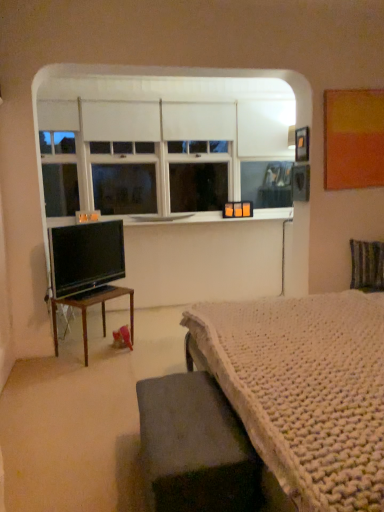
Question: Is striped fabric swivel chair at right bigger than wooden table at left, placed as the 1th table when sorted from back to front?

Choices:
 (A) no
 (B) yes

Answer: (A)

Question: Are striped fabric swivel chair at right and wooden table at left, placed as the 1th table when sorted from back to front, making contact?

Choices:
 (A) yes
 (B) no

Answer: (B)

Question: From a real-world perspective, is striped fabric swivel chair at right positioned over wooden table at left, which appears as the second table when viewed from the right, based on gravity?

Choices:
 (A) no
 (B) yes

Answer: (B)

Question: Is striped fabric swivel chair at right not near wooden table at left, placed as the 1th table when sorted from back to front?

Choices:
 (A) yes
 (B) no

Answer: (A)

Question: Does striped fabric swivel chair at right have a lesser height compared to wooden table at left, which is counted as the first table, starting from the left?

Choices:
 (A) no
 (B) yes

Answer: (B)

Question: From a real-world perspective, relative to white smooth window sill at center, is dark gray fabric ottoman at lower center, positioned as the second table in back-to-front order, vertically above or below?

Choices:
 (A) above
 (B) below

Answer: (B)

Question: Based on their positions, is dark gray fabric ottoman at lower center, the second table viewed from the left, located to the left or right of white smooth window sill at center?

Choices:
 (A) left
 (B) right

Answer: (B)

Question: Considering the positions of dark gray fabric ottoman at lower center, the second table viewed from the left, and white smooth window sill at center in the image, is dark gray fabric ottoman at lower center, the second table viewed from the left, bigger or smaller than white smooth window sill at center?

Choices:
 (A) small
 (B) big

Answer: (B)

Question: Is dark gray fabric ottoman at lower center, the 1th table positioned from the right, spatially inside white smooth window sill at center, or outside of it?

Choices:
 (A) outside
 (B) inside

Answer: (A)

Question: From a real-world perspective, is white knitted blanket at lower right above or below striped fabric swivel chair at right?

Choices:
 (A) above
 (B) below

Answer: (B)

Question: In terms of size, does white knitted blanket at lower right appear bigger or smaller than striped fabric swivel chair at right?

Choices:
 (A) small
 (B) big

Answer: (B)

Question: In terms of width, does white knitted blanket at lower right look wider or thinner when compared to striped fabric swivel chair at right?

Choices:
 (A) thin
 (B) wide

Answer: (B)

Question: Is white knitted blanket at lower right taller or shorter than striped fabric swivel chair at right?

Choices:
 (A) tall
 (B) short

Answer: (B)

Question: In terms of height, does wooden table at left, acting as the second table starting from the front, look taller or shorter compared to dark gray fabric ottoman at lower center, the second table viewed from the left?

Choices:
 (A) short
 (B) tall

Answer: (B)

Question: Is point (84, 310) closer or farther from the camera than point (148, 496)?

Choices:
 (A) farther
 (B) closer

Answer: (A)